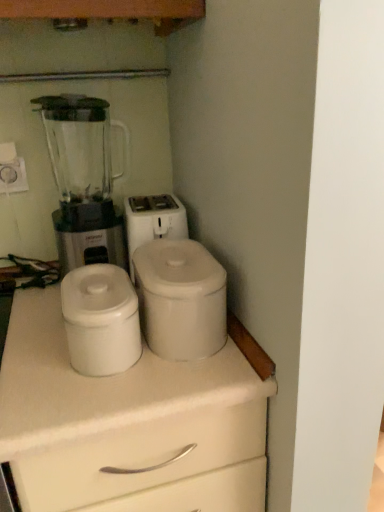
This screenshot has width=384, height=512. Find the location of `empty space that is ontop of white matte chest of drawers at center (from a real-world perspective)`. empty space that is ontop of white matte chest of drawers at center (from a real-world perspective) is located at coordinates coord(62,338).